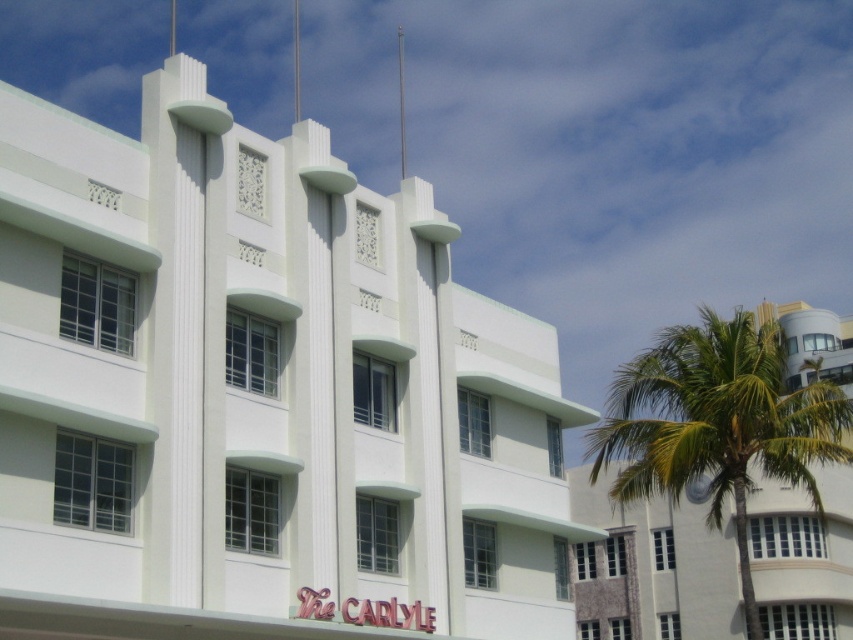
Which is in front, point (99, 228) or point (801, 436)?

Point (99, 228) is in front.

Is white smooth building at center shorter than green leafy palm tree at right?

Yes, white smooth building at center is shorter than green leafy palm tree at right.

Is point (361, 573) behind point (607, 444)?

That is False.

Image resolution: width=853 pixels, height=640 pixels. Find the location of `white smooth building at center`. white smooth building at center is located at coordinates (258, 392).